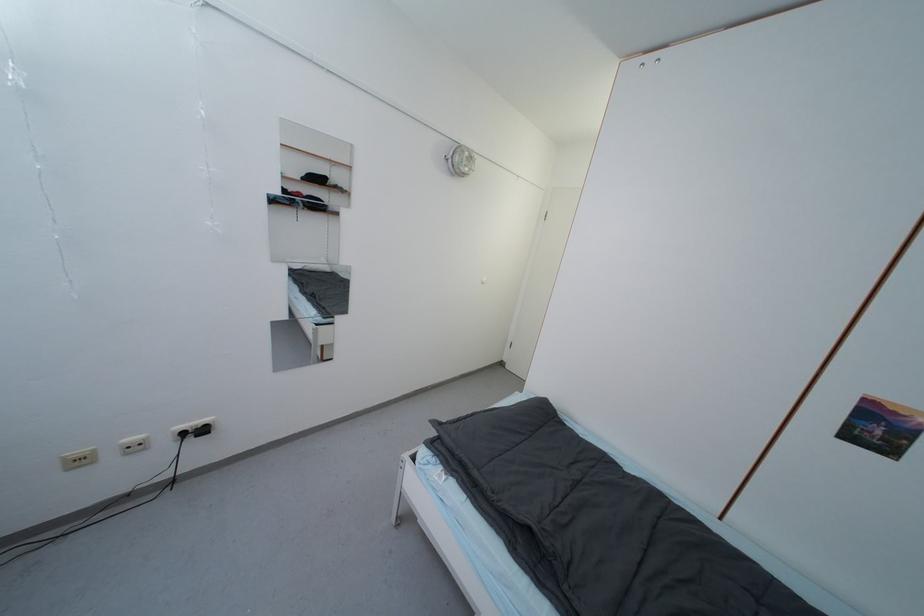
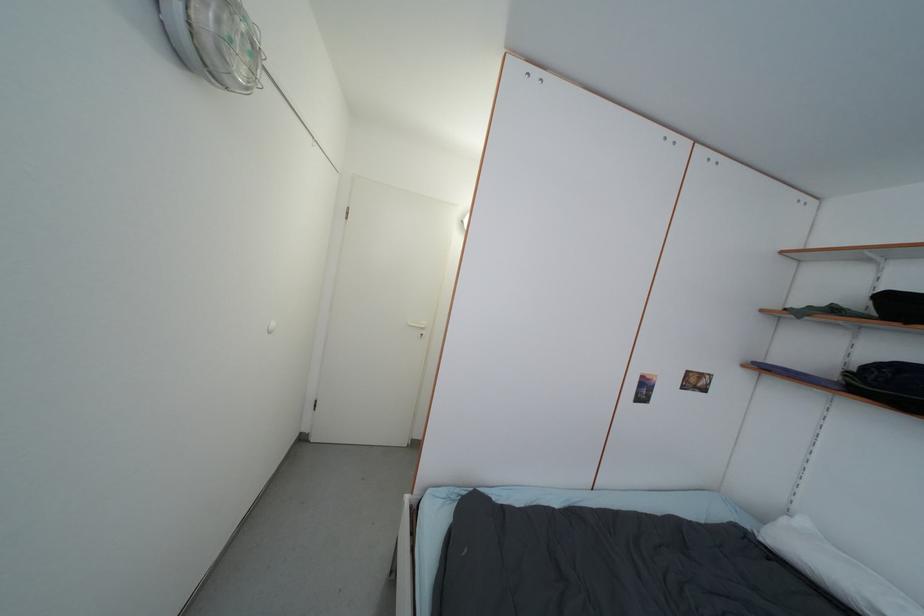
Question: Based on the continuous images, in which direction is the camera rotating? Reply with the corresponding letter.

Choices:
 (A) Left
 (B) Right
 (C) Up
 (D) Down

Answer: (B)